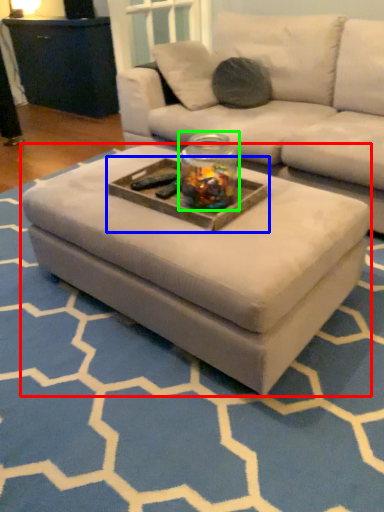
Question: Which object is the closest to the coffee table (highlighted by a red box)? Choose among these: tray (highlighted by a blue box) or glass jar (highlighted by a green box).

Choices:
 (A) tray
 (B) glass jar

Answer: (A)